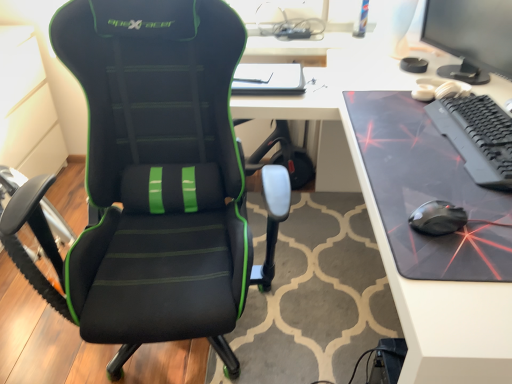
Identify the location of vacant region under matte black monitor at upper right (from a real-world perspective). (481, 83).